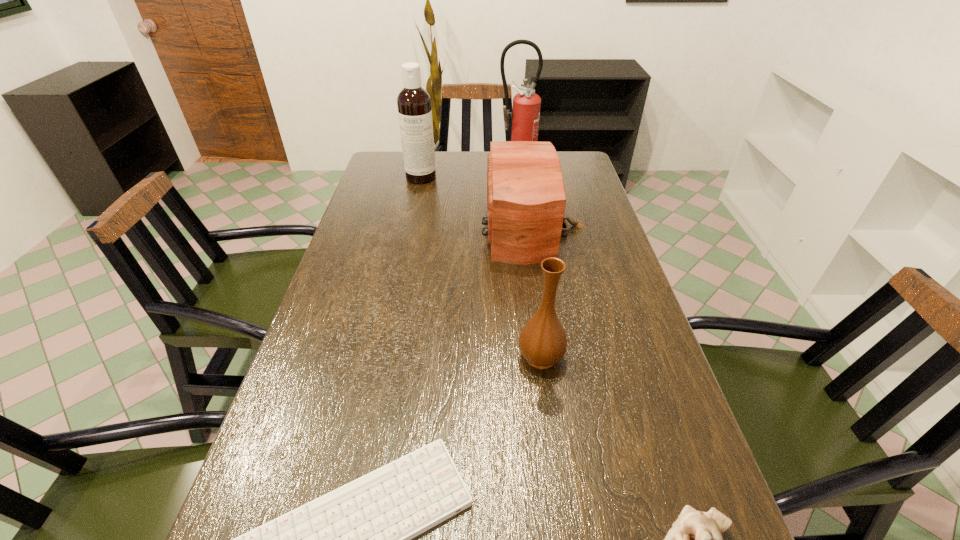
I want to click on the farthest object, so click(525, 116).

This screenshot has width=960, height=540. What are the coordinates of `dishwasher detergent` in the screenshot? It's located at (413, 102).

The height and width of the screenshot is (540, 960). In order to click on the third nearest object in this screenshot , I will do [x=542, y=341].

Locate an element on the screen. radio receiver is located at coordinates (526, 199).

Find the location of a particular element. Image resolution: width=960 pixels, height=540 pixels. free space located at the nozzle of the fire extinguisher is located at coordinates (526, 225).

This screenshot has height=540, width=960. What are the coordinates of `vacant space located on the label side of the dishwasher detergent` in the screenshot? It's located at (416, 203).

This screenshot has width=960, height=540. What are the coordinates of `vacant space located 0.360m on the back of the fourth farthest object` in the screenshot? It's located at (526, 245).

At what (x,y) coordinates should I click in order to perform the action: click on vacant region located 0.360m on the front-facing side of the radio receiver. Please return your answer as a coordinate pair (x, y). The image size is (960, 540). Looking at the image, I should click on (365, 226).

The height and width of the screenshot is (540, 960). I want to click on free space located on the front-facing side of the radio receiver, so click(374, 226).

The height and width of the screenshot is (540, 960). I want to click on blank space located on the front-facing side of the radio receiver, so click(x=358, y=226).